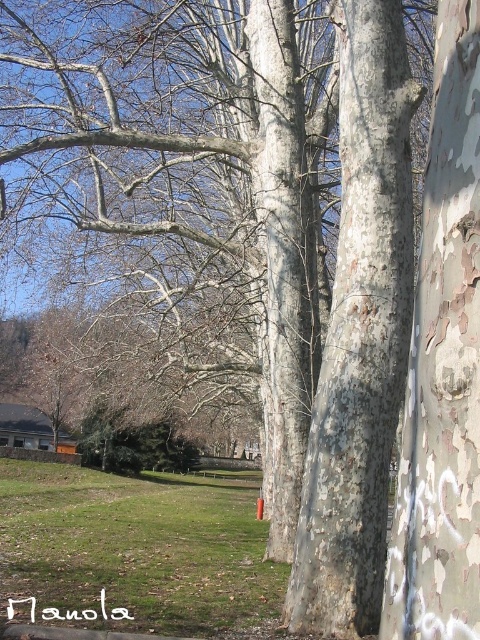
You are a botanist examining two types of tree bark in the image. The smooth gray bark at center and the white textured bark at center are both present. Which of these two barks is wider in width?

The smooth gray bark at center has a greater width compared to the white textured bark at center.

You are a gardener assessing the landscape. You notice the white textured bark at center and the green grass at lower left. Which of these two elements is shorter in height?

The white textured bark at center has a lesser height compared to the green grass at lower left, so the white textured bark at center is shorter.